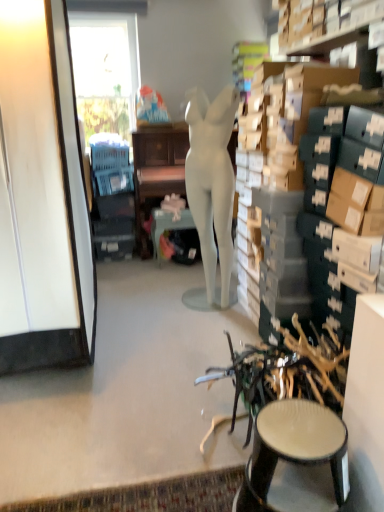
Question: Does white glossy cabinet at left appear on the right side of matte black stool at lower right?

Choices:
 (A) yes
 (B) no

Answer: (B)

Question: From the image's perspective, is white glossy cabinet at left on top of matte black stool at lower right?

Choices:
 (A) yes
 (B) no

Answer: (A)

Question: Is white glossy cabinet at left directly adjacent to matte black stool at lower right?

Choices:
 (A) yes
 (B) no

Answer: (B)

Question: Is white glossy cabinet at left shorter than matte black stool at lower right?

Choices:
 (A) yes
 (B) no

Answer: (B)

Question: Can you confirm if white glossy cabinet at left is taller than matte black stool at lower right?

Choices:
 (A) yes
 (B) no

Answer: (A)

Question: Does white glossy cabinet at left have a smaller size compared to matte black stool at lower right?

Choices:
 (A) no
 (B) yes

Answer: (A)

Question: From the image's perspective, is white glossy cabinet at left located beneath matte white desk at center?

Choices:
 (A) yes
 (B) no

Answer: (A)

Question: From the image's perspective, is white glossy cabinet at left on matte white desk at center?

Choices:
 (A) no
 (B) yes

Answer: (A)

Question: Is white glossy cabinet at left smaller than matte white desk at center?

Choices:
 (A) yes
 (B) no

Answer: (B)

Question: Considering the relative positions of white glossy cabinet at left and matte white desk at center in the image provided, is white glossy cabinet at left to the left of matte white desk at center from the viewer's perspective?

Choices:
 (A) yes
 (B) no

Answer: (A)

Question: Can you confirm if white glossy cabinet at left is shorter than matte white desk at center?

Choices:
 (A) no
 (B) yes

Answer: (A)

Question: Is white glossy cabinet at left touching matte white desk at center?

Choices:
 (A) yes
 (B) no

Answer: (B)

Question: Could you tell me if metallic teal table at center is facing white glossy cabinet at left?

Choices:
 (A) no
 (B) yes

Answer: (A)